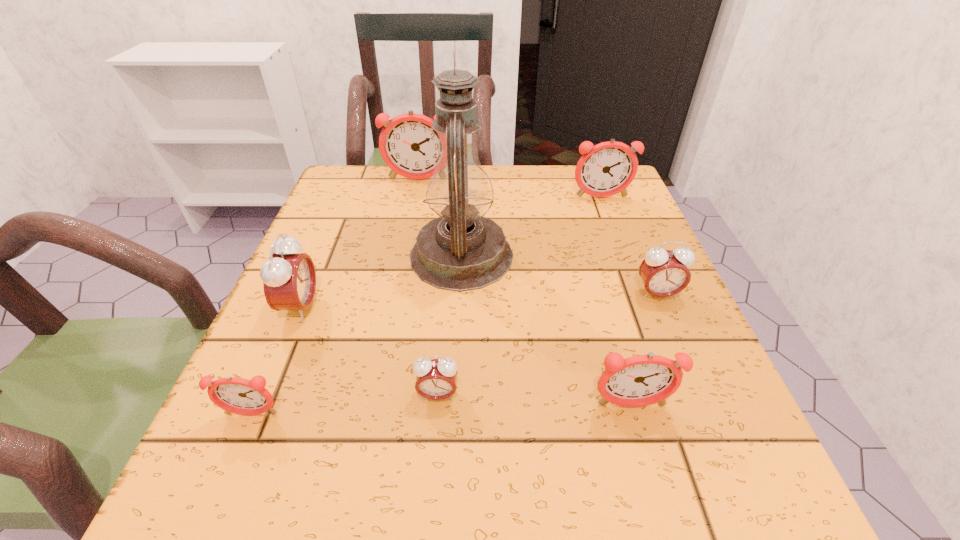
The height and width of the screenshot is (540, 960). What are the coordinates of `the tallest object` in the screenshot? It's located at (461, 250).

I want to click on the tallest alarm clock, so click(x=409, y=146).

Identify the location of the farthest alarm clock. (409, 146).

Find the location of a particular element. The height and width of the screenshot is (540, 960). the second farthest reddish-pink alarm clock is located at coordinates (606, 169).

Where is `the seventh nearest object`? Image resolution: width=960 pixels, height=540 pixels. the seventh nearest object is located at coordinates (606, 169).

I want to click on the leftmost pink alarm clock, so click(289, 278).

Find the location of a particular element. Image resolution: width=960 pixels, height=540 pixels. the rightmost pink alarm clock is located at coordinates (664, 273).

Find the location of `the second smallest reddish-pink alarm clock`. the second smallest reddish-pink alarm clock is located at coordinates (641, 380).

Locate an element on the screen. the smallest pink alarm clock is located at coordinates (436, 379).

The height and width of the screenshot is (540, 960). In order to click on the second pink alarm clock from right to left in this screenshot , I will do `click(436, 379)`.